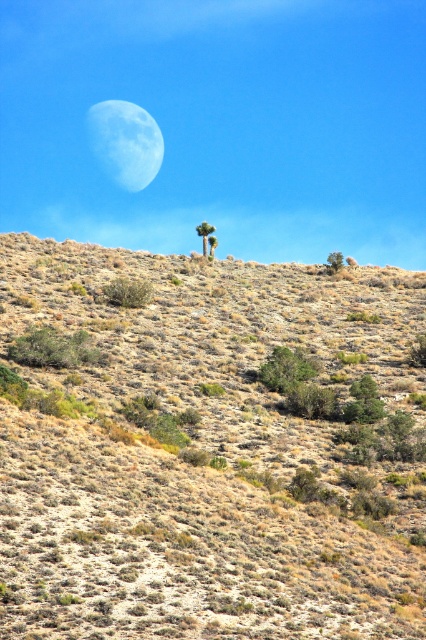
Who is positioned more to the left, dry shrubbery at center or light blue textured moon at upper center?

light blue textured moon at upper center is more to the left.

Who is more distant from viewer, (x=167, y=586) or (x=108, y=108)?

The point (x=108, y=108) is more distant.

At what (x,y) coordinates should I click in order to perform the action: click on dry shrubbery at center. Please return your answer as a coordinate pair (x, y). The image size is (426, 640). Looking at the image, I should click on (207, 449).

Where is `dry shrubbery at center`? Image resolution: width=426 pixels, height=640 pixels. dry shrubbery at center is located at coordinates (207, 449).